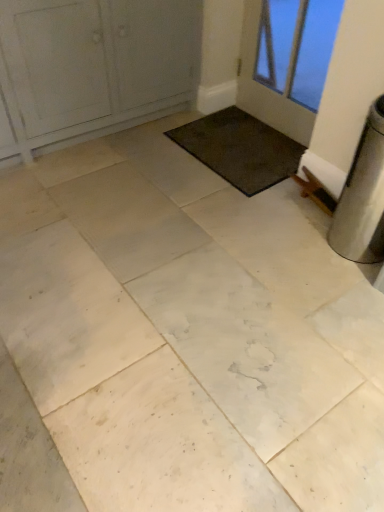
Question: Considering the relative sizes of dark brown carpet at center and white glass door at upper right, the first door from the right, in the image provided, is dark brown carpet at center bigger than white glass door at upper right, the first door from the right,?

Choices:
 (A) yes
 (B) no

Answer: (B)

Question: Does dark brown carpet at center turn towards white glass door at upper right, which is the 2th door in left-to-right order?

Choices:
 (A) yes
 (B) no

Answer: (B)

Question: Is the surface of dark brown carpet at center in direct contact with white glass door at upper right, which is the 2th door in left-to-right order?

Choices:
 (A) yes
 (B) no

Answer: (B)

Question: From the image's perspective, does dark brown carpet at center appear lower than white glass door at upper right, which is the 2th door in left-to-right order?

Choices:
 (A) no
 (B) yes

Answer: (B)

Question: Is dark brown carpet at center outside white glass door at upper right, the first door from the right?

Choices:
 (A) no
 (B) yes

Answer: (B)

Question: Looking at the image, does white glass door at upper right, which is the 2th door in left-to-right order, seem bigger or smaller compared to white painted wood door at upper left, acting as the 2th door starting from the right?

Choices:
 (A) big
 (B) small

Answer: (B)

Question: Is point (268, 75) closer or farther from the camera than point (31, 32)?

Choices:
 (A) farther
 (B) closer

Answer: (A)

Question: From the image's perspective, is white glass door at upper right, which is the 2th door in left-to-right order, located above or below white painted wood door at upper left, acting as the 2th door starting from the right?

Choices:
 (A) below
 (B) above

Answer: (A)

Question: In the image, is white glass door at upper right, which is the 2th door in left-to-right order, positioned in front of or behind white painted wood door at upper left, the first door positioned from the left?

Choices:
 (A) behind
 (B) front

Answer: (A)

Question: In the image, is dark brown carpet at center on the left side or the right side of white glass door at upper right, the first door from the right?

Choices:
 (A) right
 (B) left

Answer: (B)

Question: Looking at the image, does dark brown carpet at center seem bigger or smaller compared to white glass door at upper right, which is the 2th door in left-to-right order?

Choices:
 (A) big
 (B) small

Answer: (B)

Question: Does point (243, 137) appear closer or farther from the camera than point (324, 81)?

Choices:
 (A) farther
 (B) closer

Answer: (A)

Question: From the image's perspective, relative to white glass door at upper right, which is the 2th door in left-to-right order, is dark brown carpet at center above or below?

Choices:
 (A) above
 (B) below

Answer: (B)

Question: From the image's perspective, relative to dark brown carpet at center, is white painted wood door at upper left, acting as the 2th door starting from the right, above or below?

Choices:
 (A) above
 (B) below

Answer: (A)

Question: From a real-world perspective, is white painted wood door at upper left, acting as the 2th door starting from the right, above or below dark brown carpet at center?

Choices:
 (A) below
 (B) above

Answer: (B)